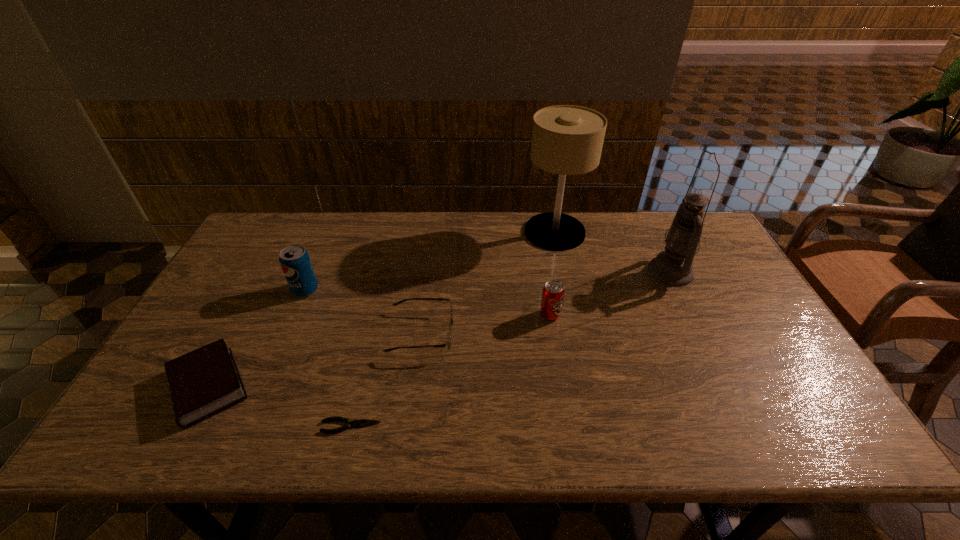
Identify the location of object present at the right edge. (674, 266).

Where is `object located at the near left corner`? The height and width of the screenshot is (540, 960). object located at the near left corner is located at coordinates (206, 381).

In the image, there is a desktop. Identify the location of vacant space at the far edge. (437, 212).

The height and width of the screenshot is (540, 960). In the image, there is a desktop. Identify the location of vacant space at the near edge. (454, 426).

The width and height of the screenshot is (960, 540). What are the coordinates of `vacant space at the left edge of the desktop` in the screenshot? It's located at (275, 254).

Find the location of a particular element. The width and height of the screenshot is (960, 540). free space at the right edge of the desktop is located at coordinates (724, 305).

I want to click on vacant position at the near right corner of the desktop, so click(x=771, y=415).

Find the location of `empty location between the spectacles and the shorter soda`. empty location between the spectacles and the shorter soda is located at coordinates (486, 325).

Identify the location of free point between the spectacles and the shorter soda. (486, 325).

Where is `free space between the rightmost object and the pliers`? This screenshot has height=540, width=960. free space between the rightmost object and the pliers is located at coordinates (511, 349).